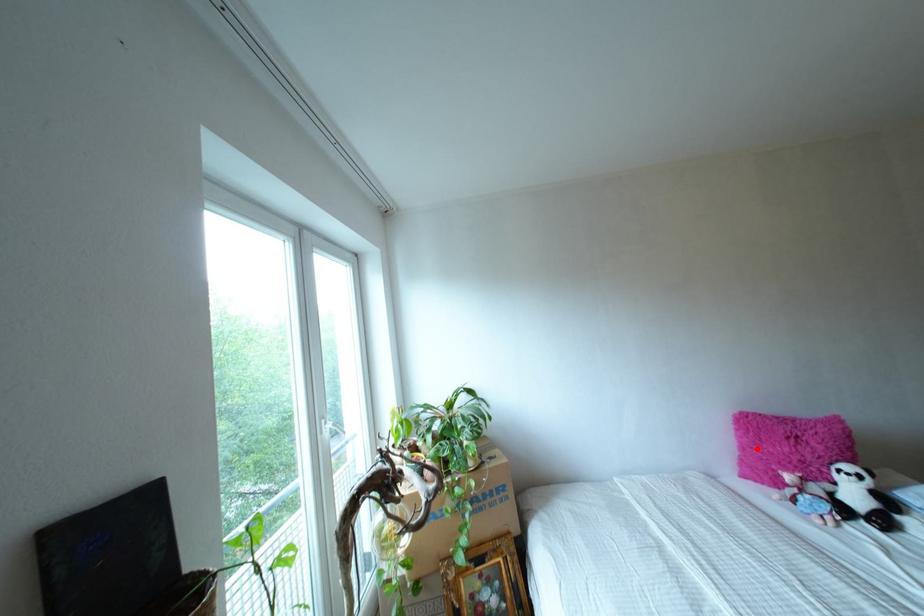
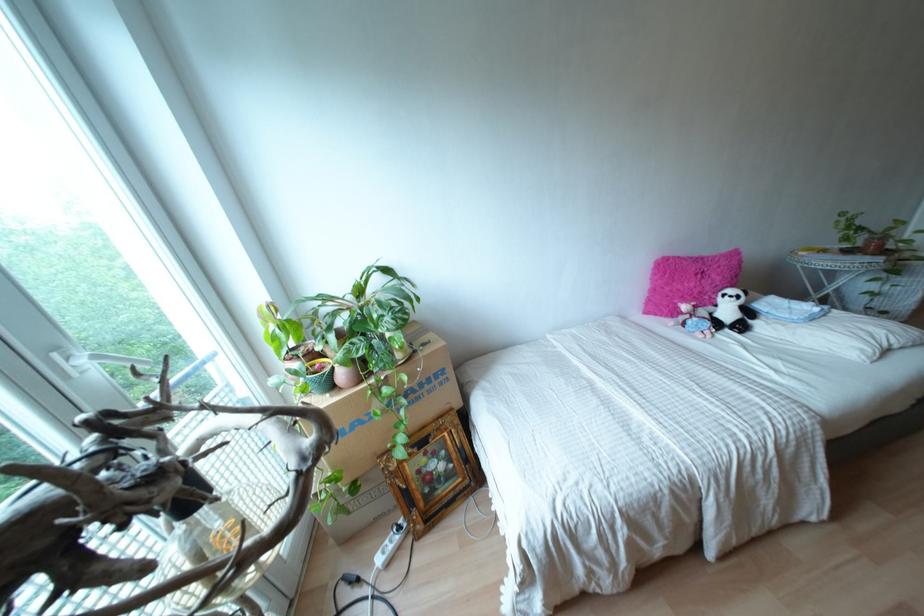
The point at the highlighted location is marked in the first image. Where is the corresponding point in the second image?

(666, 288)